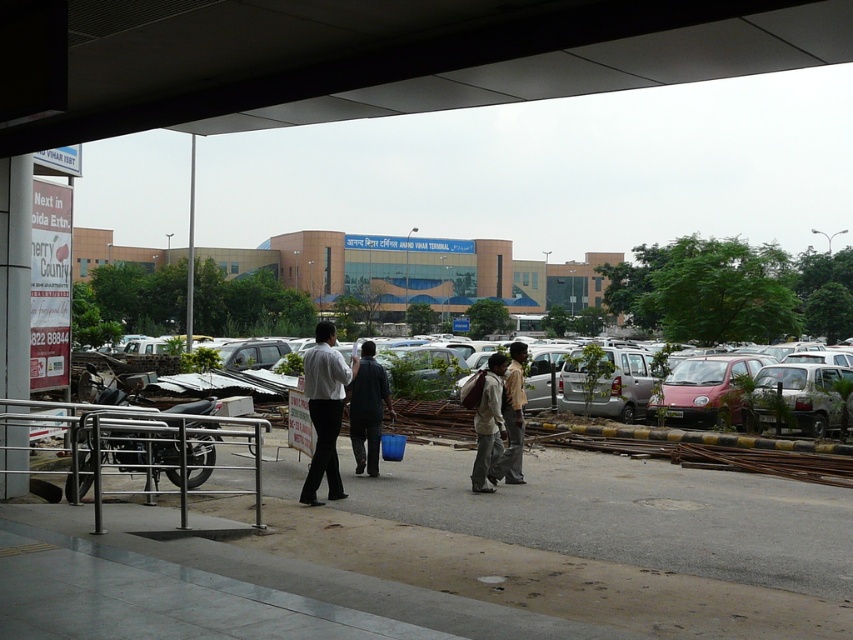
Question: Does light brown fabric pants at center appear under dark blue shirt at center?

Choices:
 (A) no
 (B) yes

Answer: (A)

Question: Can you confirm if black matte ceiling at upper center is positioned above white matte shirt at center?

Choices:
 (A) no
 (B) yes

Answer: (B)

Question: Which point appears closest to the camera in this image?

Choices:
 (A) (505, 360)
 (B) (369, 346)

Answer: (A)

Question: Which of the following is the farthest from the observer?

Choices:
 (A) silver metallic rail at lower left
 (B) white matte shirt at center

Answer: (B)

Question: Does black matte ceiling at upper center have a greater width compared to white matte shirt at center?

Choices:
 (A) yes
 (B) no

Answer: (A)

Question: Which object is farther from the camera taking this photo?

Choices:
 (A) white matte shirt at center
 (B) dark blue shirt at center

Answer: (B)